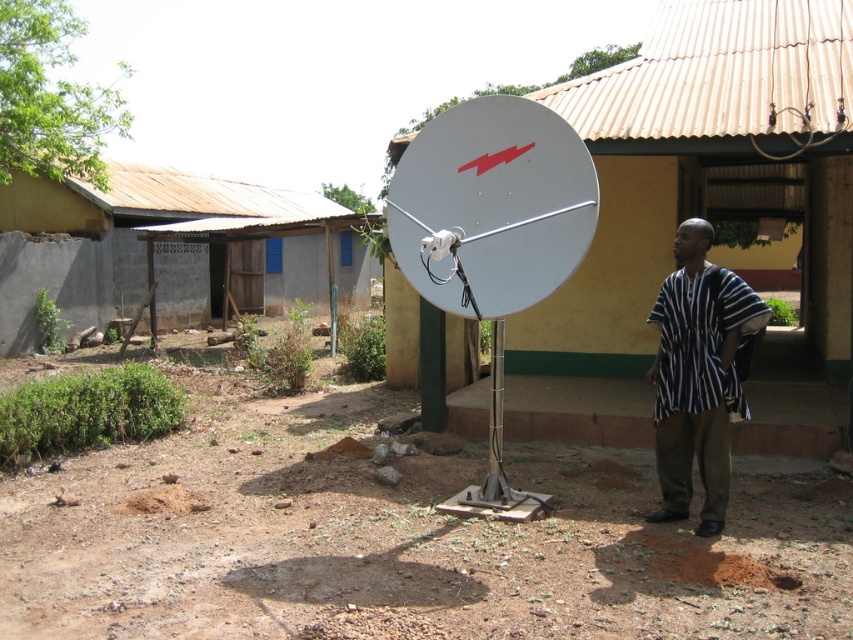
Who is more forward, (x=82, y=211) or (x=474, y=116)?

Point (x=474, y=116) is more forward.

Is point (35, 200) closer to viewer compared to point (404, 193)?

No, it is not.

Does point (207, 296) come closer to viewer compared to point (555, 285)?

No.

Find the location of a particular element. gray concrete hut at center is located at coordinates pyautogui.click(x=148, y=248).

Does point (820, 234) come behind point (505, 192)?

That is True.

Which is below, metallic satellite dish at center or white metallic satellite at center?

white metallic satellite at center

Image resolution: width=853 pixels, height=640 pixels. Identify the location of metallic satellite dish at center. (701, 216).

The width and height of the screenshot is (853, 640). Identify the location of metallic satellite dish at center. (701, 216).

Can you confirm if brown soil at center is positioned below metallic satellite dish at center?

Correct, brown soil at center is located below metallic satellite dish at center.

Who is taller, brown soil at center or metallic satellite dish at center?

metallic satellite dish at center

Is point (289, 403) positioned before point (547, 93)?

That is False.

Where is `brown soil at center`? brown soil at center is located at coordinates 399,538.